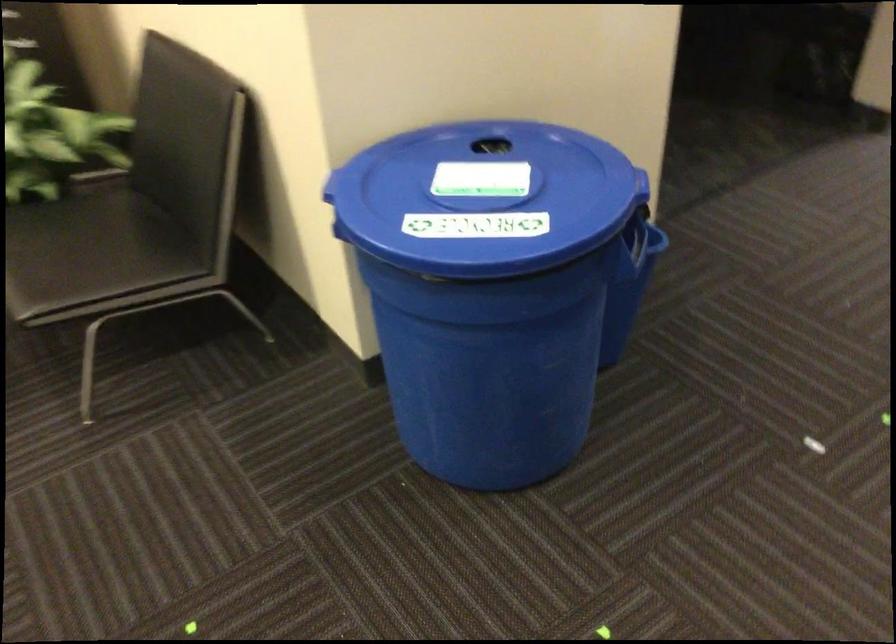
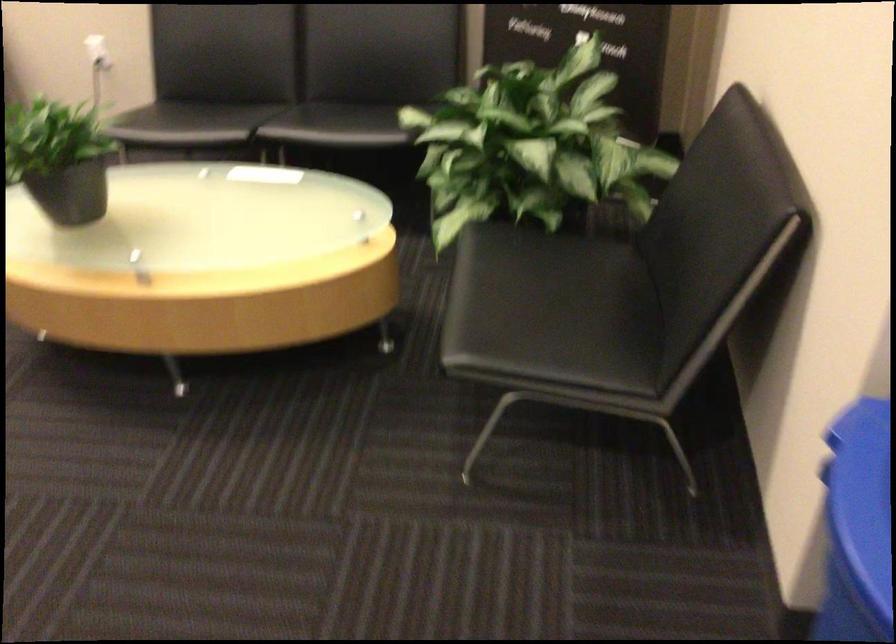
Question: Based on the continuous images, in which direction is the camera rotating? Reply with the corresponding letter.

Choices:
 (A) Left
 (B) Right
 (C) Up
 (D) Down

Answer: (A)